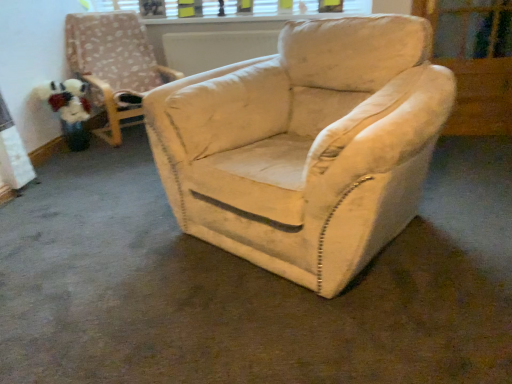
Question: From the image's perspective, is white plastic window frame at upper center located above or below transparent glass screen door at upper right?

Choices:
 (A) above
 (B) below

Answer: (A)

Question: Considering the positions of white plastic window frame at upper center and transparent glass screen door at upper right in the image, is white plastic window frame at upper center taller or shorter than transparent glass screen door at upper right?

Choices:
 (A) tall
 (B) short

Answer: (B)

Question: Which of these objects is positioned closest to the velvet beige armchair at center?

Choices:
 (A) transparent glass screen door at upper right
 (B) fluffy fabric toy at left
 (C) white plastic window frame at upper center

Answer: (B)

Question: Which is farther from the velvet beige armchair at center?

Choices:
 (A) white plastic window frame at upper center
 (B) transparent glass screen door at upper right
 (C) fluffy fabric toy at left

Answer: (B)